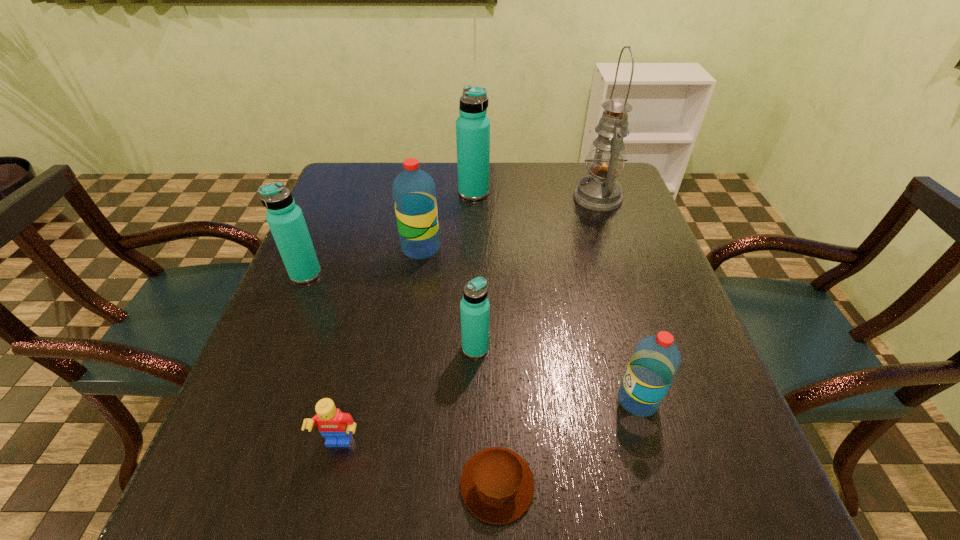
Locate an element on the screen. The image size is (960, 540). blank space located 0.400m on the back of the smallest blue water bottle is located at coordinates (476, 219).

Locate an element on the screen. The width and height of the screenshot is (960, 540). vacant space positioned 0.370m on the front label of the third nearest object is located at coordinates (412, 400).

This screenshot has width=960, height=540. Identify the location of vacant area located 0.350m on the front label of the third nearest object. (422, 400).

At what (x,y) coordinates should I click in order to perform the action: click on free space located 0.280m on the front label of the third nearest object. Please return your answer as a coordinate pair (x, y). This screenshot has width=960, height=540. Looking at the image, I should click on pos(462,400).

Identify the location of vacant space located 0.190m on the right of the muffin. (657, 485).

Locate an element on the screen. oil lamp that is at the far edge is located at coordinates (599, 191).

Find the location of a particular element. water bottle situated at the far edge is located at coordinates (472, 126).

Where is `object located at the near edge`? object located at the near edge is located at coordinates (497, 485).

Find the location of a particular element. The height and width of the screenshot is (540, 960). object that is at the left edge is located at coordinates (285, 219).

Where is `oil lamp that is at the right edge`? The image size is (960, 540). oil lamp that is at the right edge is located at coordinates (599, 191).